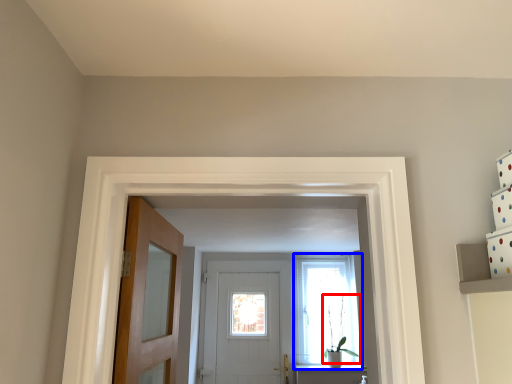
Question: Which object appears farthest to the camera in this image, plant (highlighted by a red box) or window (highlighted by a blue box)?

Choices:
 (A) plant
 (B) window

Answer: (B)